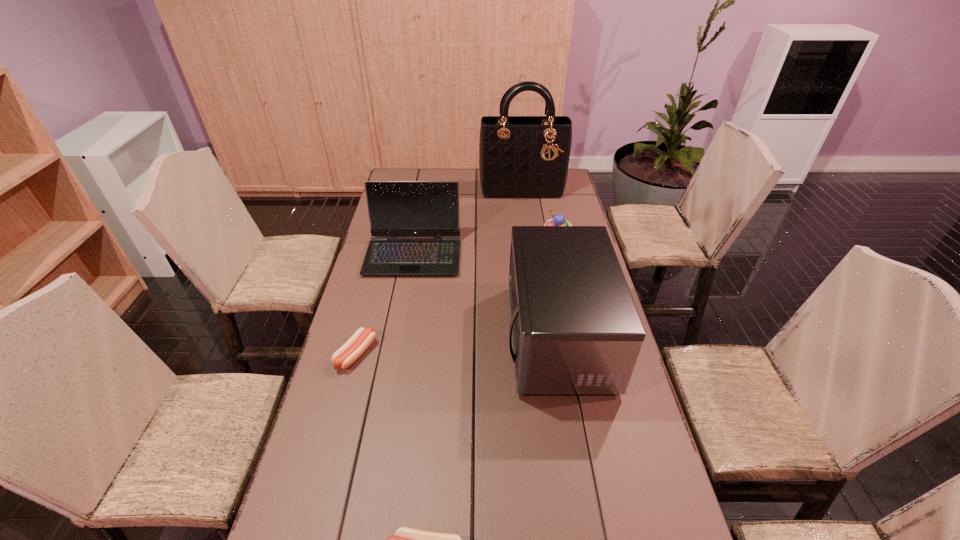
You are a GUI agent. You are given a task and a screenshot of the screen. Output one action in this format:
    pyautogui.click(x=<x>, y=<y>)
    Task: Click on the vacant space at the left edge of the desktop
    
    Given the screenshot: What is the action you would take?
    pyautogui.click(x=385, y=325)

This screenshot has width=960, height=540. Identify the location of vacant space at the right edge. (614, 520).

Locate an element on the screen. This screenshot has height=540, width=960. vacant space in between the farther sausage and the icecream is located at coordinates (456, 298).

The image size is (960, 540). I want to click on vacant area between the laptop computer and the farthest object, so click(468, 222).

The image size is (960, 540). What are the coordinates of `unoccupied position between the laptop computer and the icecream` in the screenshot? It's located at (x=485, y=248).

The image size is (960, 540). What are the coordinates of `the third closest object to the left sausage` in the screenshot? It's located at [406, 539].

Where is `object that stands as the second closest to the laptop computer`? This screenshot has width=960, height=540. object that stands as the second closest to the laptop computer is located at coordinates (346, 355).

Where is `the closest sausage to the farthest object`? Image resolution: width=960 pixels, height=540 pixels. the closest sausage to the farthest object is located at coordinates [x=346, y=355].

Locate an element on the screen. Image resolution: width=960 pixels, height=540 pixels. sausage that can be found as the closest to the laptop computer is located at coordinates (346, 355).